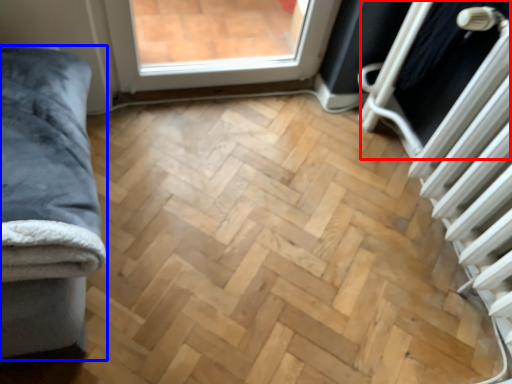
Question: Which object appears closest to the camera in this image, screen door (highlighted by a red box) or furniture (highlighted by a blue box)?

Choices:
 (A) screen door
 (B) furniture

Answer: (B)